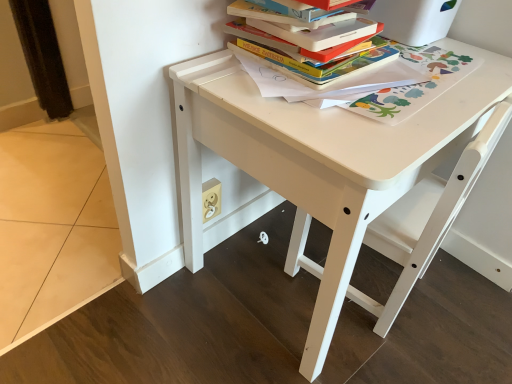
You are a GUI agent. You are given a task and a screenshot of the screen. Output one action in this format:
    pyautogui.click(x=<x>, y=<y>)
    Task: Click on the spots to the right of white matte chair at center
    This screenshot has height=384, width=512.
    Given the screenshot: What is the action you would take?
    pyautogui.click(x=462, y=310)